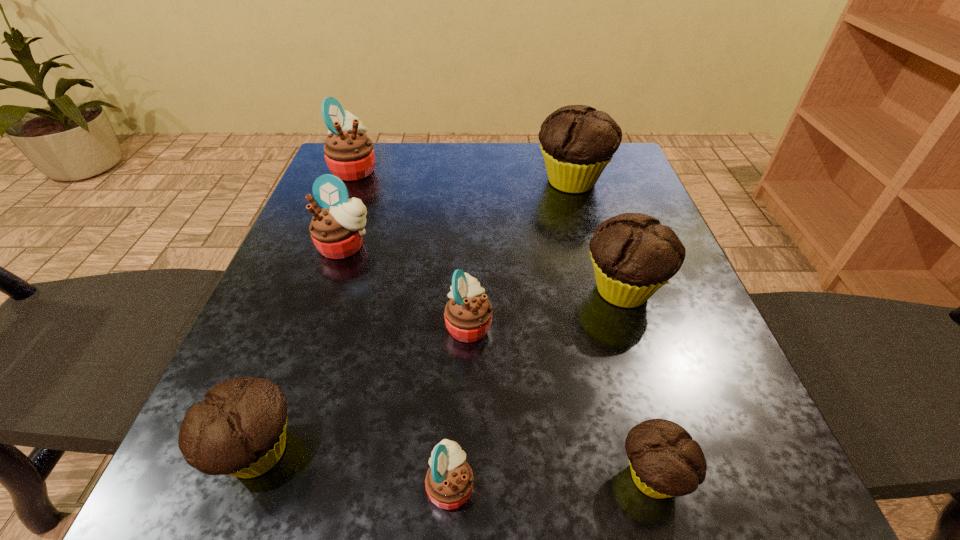
Select which pink muffin appears as the fourth closest to the third smallest chocolate muffin. Please provide its 2D coordinates. Your answer should be formatted as a tuple, i.e. [(x, y)], where the tuple contains the x and y coordinates of a point satisfying the conditions above.

[(349, 153)]

Locate which chocolate muffin ranks fourth in proximity to the second biggest pink muffin. Please provide its 2D coordinates. Your answer should be formatted as a tuple, i.e. [(x, y)], where the tuple contains the x and y coordinates of a point satisfying the conditions above.

[(665, 461)]

Locate which chocolate muffin is the closest to the smallest chocolate muffin. Please provide its 2D coordinates. Your answer should be formatted as a tuple, i.e. [(x, y)], where the tuple contains the x and y coordinates of a point satisfying the conditions above.

[(633, 255)]

I want to click on blank area in the image that satisfies the following two spatial constraints: 1. on the front-facing side of the smallest chocolate muffin; 2. on the right side of the third biggest pink muffin, so (x=466, y=476).